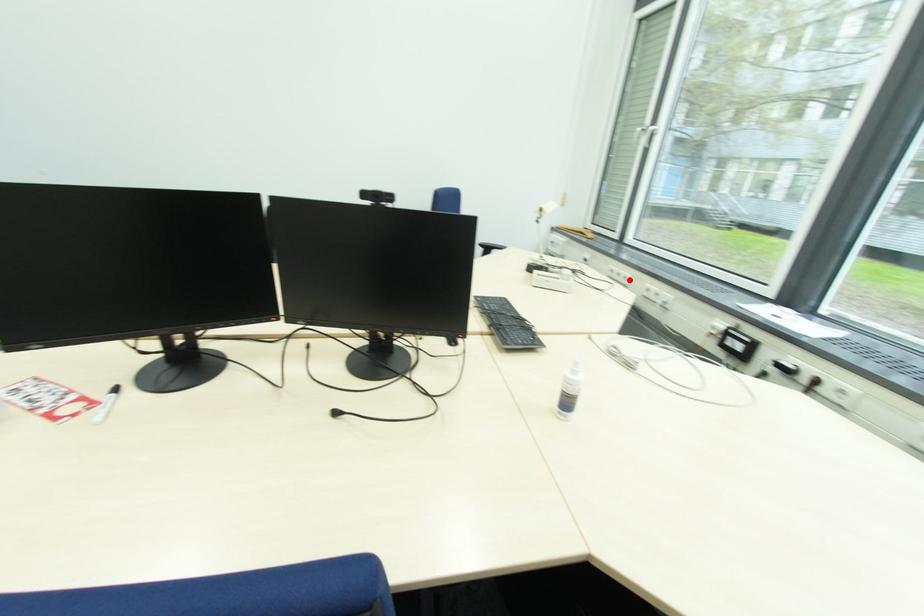
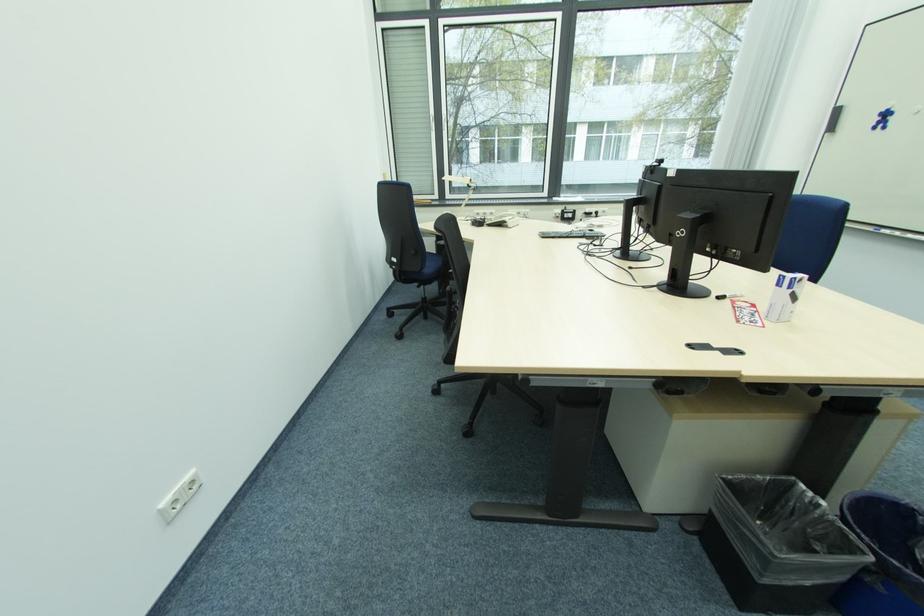
Where in the second image is the point corresponding to the highlighted location from the first image?

(494, 216)